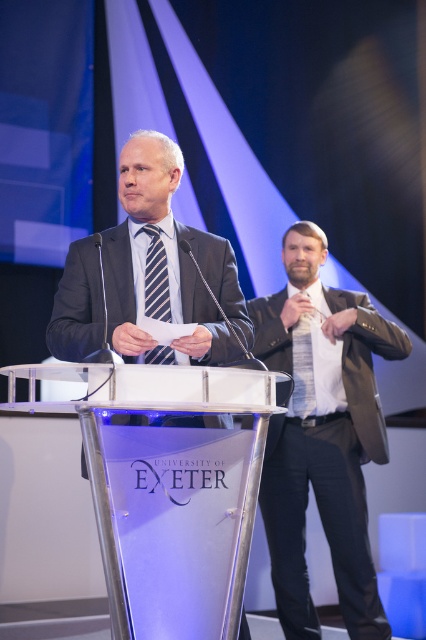
Is transparent acrylic podium at center further to the viewer compared to matte black tie at right?

No, transparent acrylic podium at center is closer to the viewer.

Find the location of a particular element. transparent acrylic podium at center is located at coordinates (167, 486).

Between transparent acrylic podium at center and dark brown leather jacket at right, which one is positioned higher?

dark brown leather jacket at right

Locate an element on the screen. This screenshot has height=640, width=426. transparent acrylic podium at center is located at coordinates (167, 486).

Where is `transparent acrylic podium at center`? The image size is (426, 640). transparent acrylic podium at center is located at coordinates (167, 486).

Who is positioned more to the left, striped fabric tie at center or matte black tie at right?

striped fabric tie at center

Can you confirm if striped fabric tie at center is positioned below matte black tie at right?

Incorrect, striped fabric tie at center is not positioned below matte black tie at right.

Which is behind, point (167, 288) or point (307, 364)?

The point (307, 364) is more distant.

At what (x,y) coordinates should I click in order to perform the action: click on striped fabric tie at center. Please return your answer as a coordinate pair (x, y). This screenshot has height=640, width=426. Looking at the image, I should click on (155, 276).